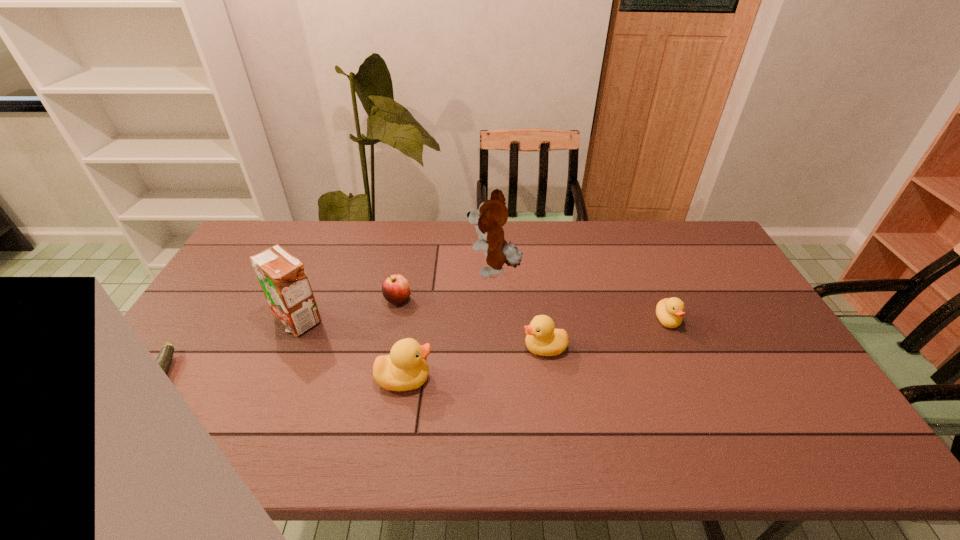
Locate an element on the screen. Image resolution: width=960 pixels, height=540 pixels. the third tallest object is located at coordinates (405, 369).

This screenshot has width=960, height=540. I want to click on the tallest duckling, so click(405, 369).

Find the location of `the second duckling from right to left`. the second duckling from right to left is located at coordinates (542, 338).

Identify the location of the fourth tallest object. (542, 338).

Locate an element on the screen. The image size is (960, 540). the rightmost duckling is located at coordinates (669, 311).

The image size is (960, 540). I want to click on the shortest duckling, so (x=669, y=311).

You are a GUI agent. You are given a task and a screenshot of the screen. Output one action in this format:
    pyautogui.click(x=<x>, y=<y>)
    Task: Click on the carton
    The height and width of the screenshot is (540, 960).
    Given the screenshot: What is the action you would take?
    pyautogui.click(x=283, y=278)

Image resolution: width=960 pixels, height=540 pixels. I want to click on the second tallest object, so click(x=283, y=278).

Locate an element on the screen. puppy is located at coordinates (492, 214).

Where is `the farthest object`? the farthest object is located at coordinates (492, 214).